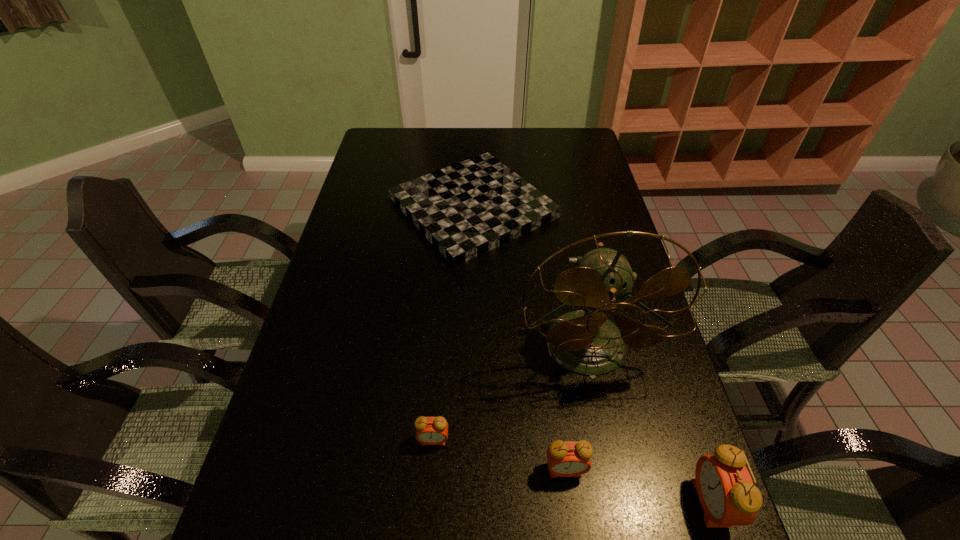
Locate an element on the screen. vacant space located on the face of the third farthest object is located at coordinates (427, 526).

I want to click on vacant space located on the face of the third tallest object, so click(x=571, y=518).

This screenshot has height=540, width=960. I want to click on vacant space located 0.280m on the face of the tallest alarm clock, so click(551, 502).

In order to click on vacant region located 0.230m on the face of the tallest alarm clock in this screenshot , I will do `click(577, 502)`.

You are a GUI agent. You are given a task and a screenshot of the screen. Output one action in this format:
    pyautogui.click(x=<x>, y=<y>)
    Task: Click on the free space located 0.190m on the face of the tallest alarm clock
    Image resolution: width=960 pixels, height=540 pixels.
    Given the screenshot: What is the action you would take?
    pyautogui.click(x=598, y=502)

What are the coordinates of `free space located 0.120m on the front of the checkerboard` in the screenshot? It's located at (471, 298).

Where is `vacant space positioned in front of the fan, directing air flow`? Image resolution: width=960 pixels, height=540 pixels. vacant space positioned in front of the fan, directing air flow is located at coordinates (612, 474).

What are the coordinates of `object that is at the left edge` in the screenshot? It's located at (467, 209).

Where is `alarm clock situated at the right edge`? Image resolution: width=960 pixels, height=540 pixels. alarm clock situated at the right edge is located at coordinates (725, 488).

Identify the location of fan located at the right edge. (586, 342).